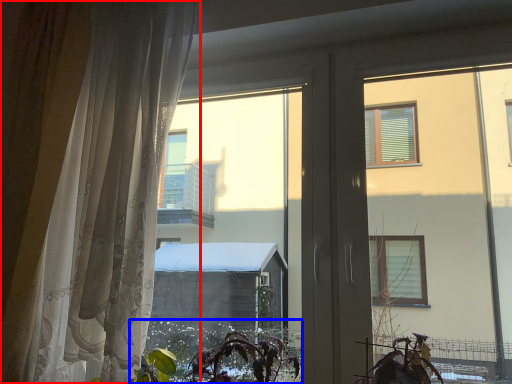
Question: Which object appears closest to the camera in this image, curtain (highlighted by a red box) or vegetation (highlighted by a blue box)?

Choices:
 (A) curtain
 (B) vegetation

Answer: (A)